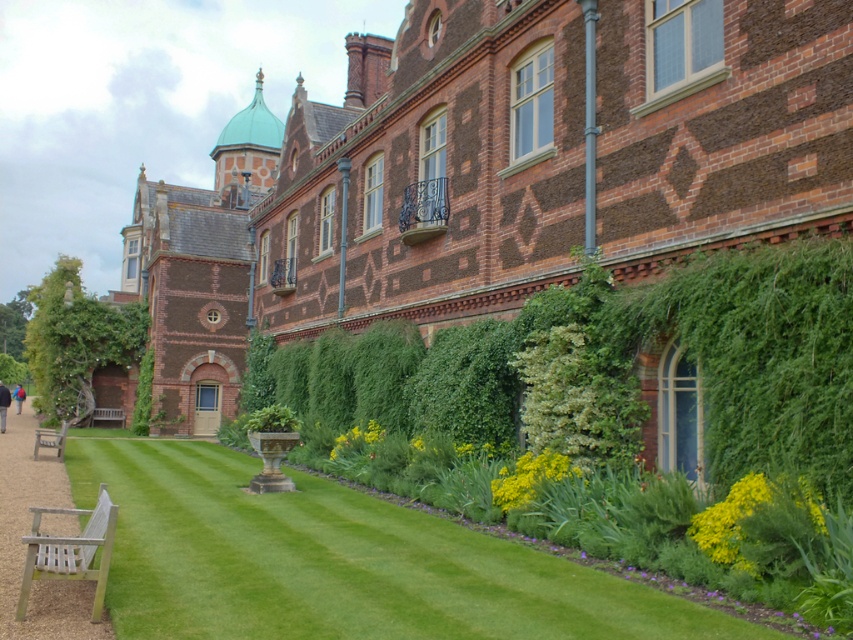
Question: Does green lawn at lower left appear over wooden slats bench at lower left?

Choices:
 (A) no
 (B) yes

Answer: (A)

Question: Considering the relative positions of wooden park bench at lower left and teak wood bench at lower left in the image provided, where is wooden park bench at lower left located with respect to teak wood bench at lower left?

Choices:
 (A) below
 (B) above

Answer: (B)

Question: Which point is closer to the camera?

Choices:
 (A) yellow matte flower at lower center
 (B) yellow-green leafy plant at lower center
 (C) teak wood bench at lower left
 (D) yellow-green leafy plant at lower right

Answer: (D)

Question: Does yellow matte flower at lower center have a smaller size compared to yellow-green leafy plant at lower center?

Choices:
 (A) no
 (B) yes

Answer: (B)

Question: Which point is farther to the camera?

Choices:
 (A) (44, 433)
 (B) (373, 454)
 (C) (711, 552)
 (D) (107, 419)

Answer: (D)

Question: Based on their relative distances, which object is farther from the wooden park bench at lower left?

Choices:
 (A) yellow matte flower at lower center
 (B) wooden slats bench at lower left
 (C) yellow-green leafy plant at lower right

Answer: (C)